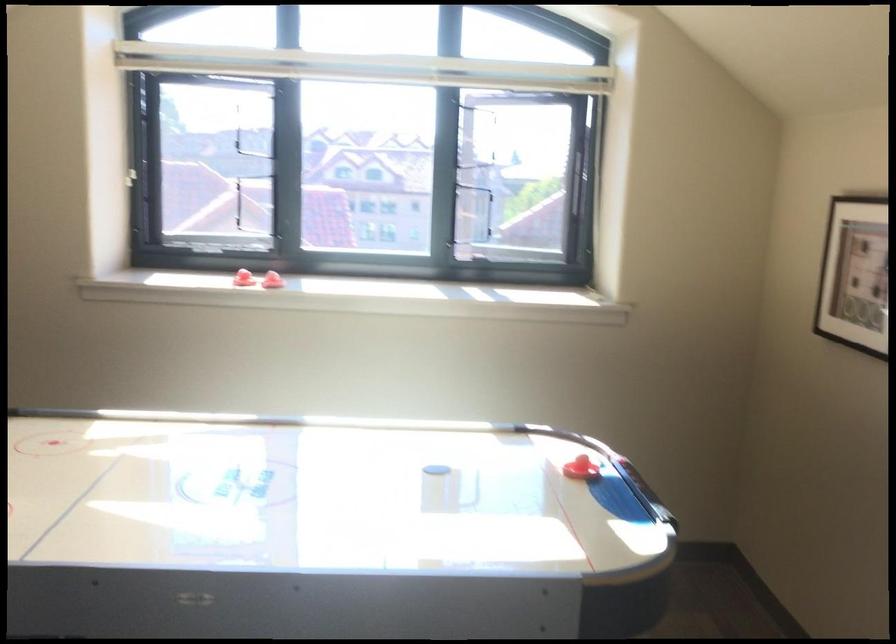
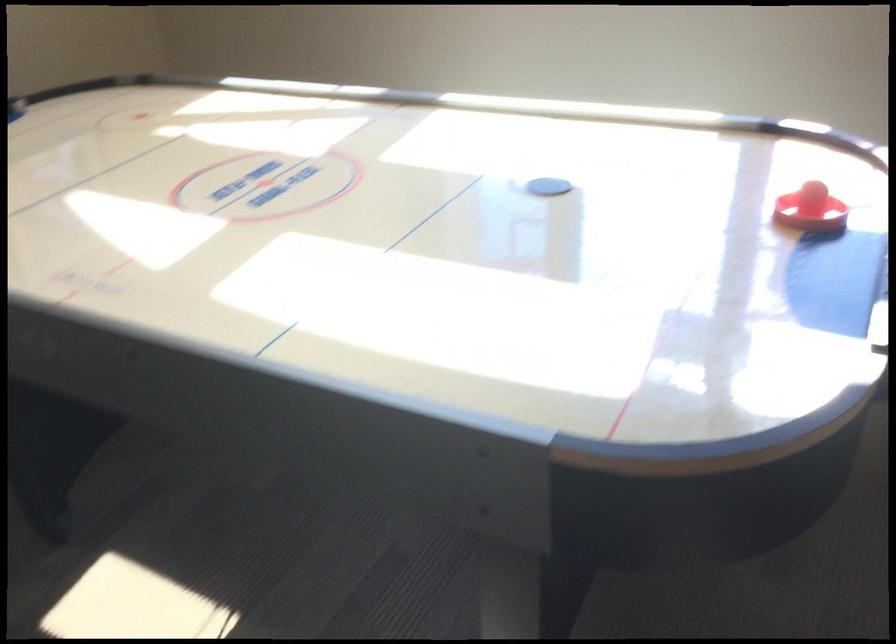
The images are taken continuously from a first-person perspective. In which direction is your viewpoint rotating?

The rotation direction of the camera is left-down.